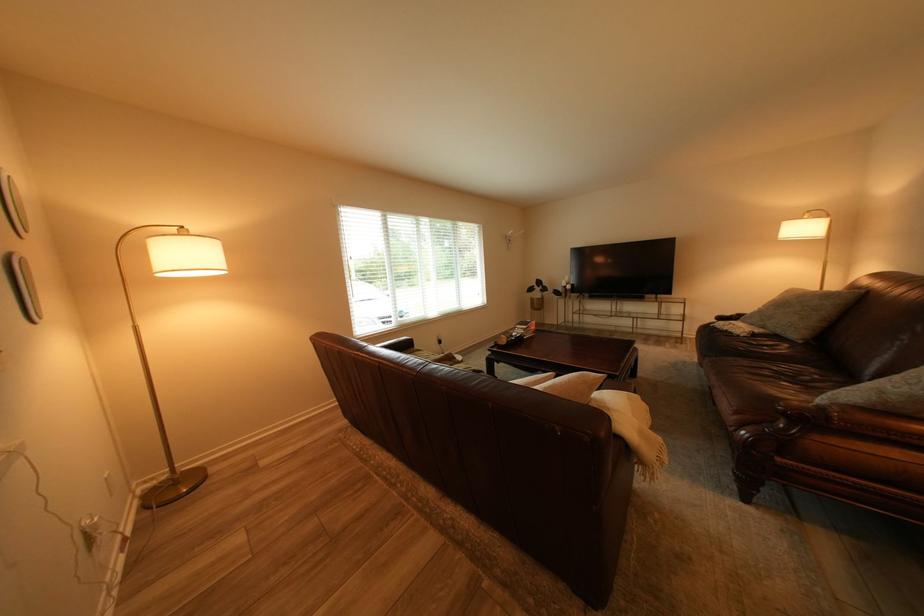
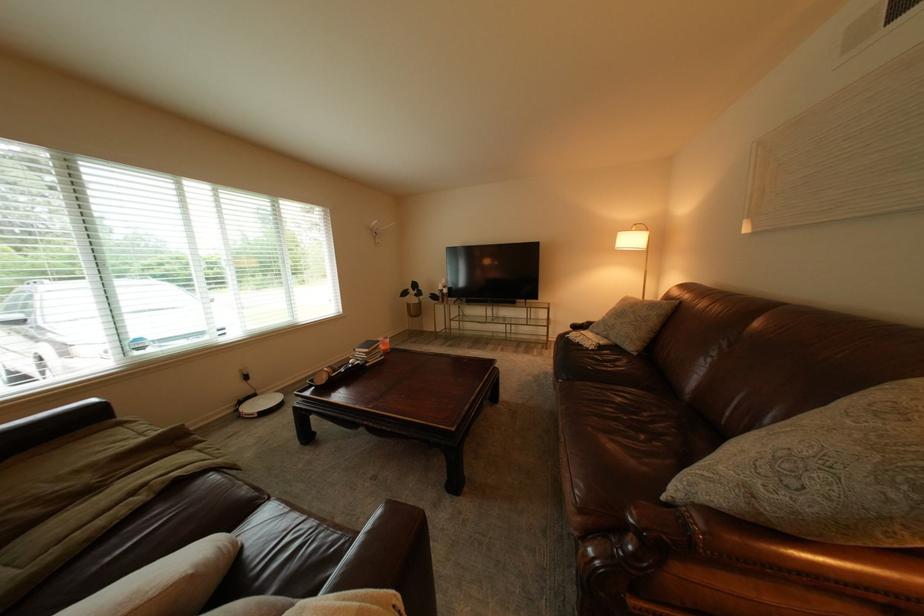
Locate, in the second image, the point that corresponds to the point at 796,405 in the first image.

(648, 513)